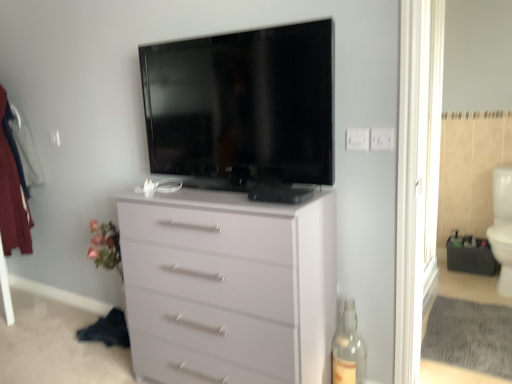
Question: Is flat screen tv at upper center in front of or behind transparent glass door at right in the image?

Choices:
 (A) behind
 (B) front

Answer: (B)

Question: Based on their sizes in the image, would you say flat screen tv at upper center is bigger or smaller than transparent glass door at right?

Choices:
 (A) big
 (B) small

Answer: (B)

Question: Based on their relative distances, which object is farther from the white glossy toilet bowl at right?

Choices:
 (A) white plastic electric outlet at upper right, which appears as the 2th electric outlet when viewed from the left
 (B) transparent glass door at right
 (C) white glossy chest of drawers at center
 (D) flat screen tv at upper center
 (E) white plastic electric outlet at upper right, which appears as the first electric outlet when viewed from the left

Answer: (D)

Question: Estimate the real-world distances between objects in this image. Which object is farther from the flat screen tv at upper center?

Choices:
 (A) white glossy chest of drawers at center
 (B) transparent glass door at right
 (C) white plastic electric outlet at upper right, which ranks as the second electric outlet in right-to-left order
 (D) white plastic electric outlet at upper right, positioned as the first electric outlet in right-to-left order
 (E) transparent glass bottle at lower right

Answer: (E)